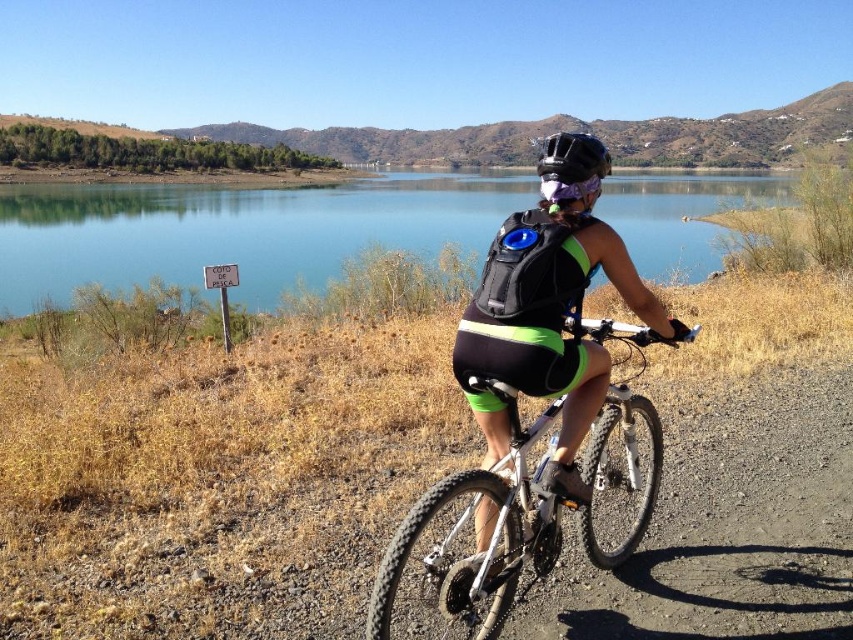
You are a photographer aiming to capture a clear shot of the cyclist while ensuring both the blue water at center and the black matte helmet at center are visible. Which object should you focus on first to ensure the cyclist and the water are in sharp focus?

The black matte helmet at center is behind blue water at center. To ensure both are in focus, focus on the black matte helmet at center since it is farther away, allowing the blue water at center to also be within the depth of field.

You are a photographer planning to take a wide shot of the scene. You want to ensure both the blue water at center and the black matte helmet at center are clearly visible. Based on their sizes in the image, which object should you focus on to ensure both are in frame?

The blue water at center might be wider than black matte helmet at center, so focusing on the blue water at center would ensure both are in frame since it occupies more space.